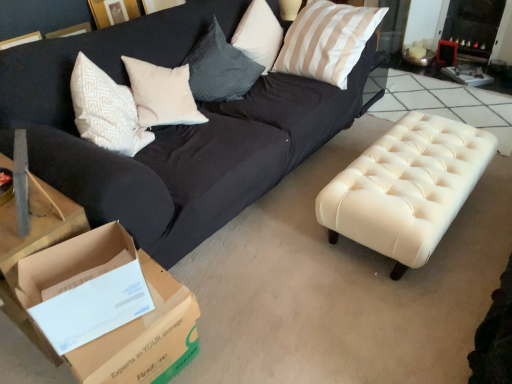
Question: Is brown cardboard box at lower left not within creamy leather ottoman at center?

Choices:
 (A) yes
 (B) no

Answer: (A)

Question: Does brown cardboard box at lower left have a greater height compared to creamy leather ottoman at center?

Choices:
 (A) yes
 (B) no

Answer: (B)

Question: From a real-world perspective, is brown cardboard box at lower left located higher than creamy leather ottoman at center?

Choices:
 (A) no
 (B) yes

Answer: (A)

Question: Is brown cardboard box at lower left closer to camera compared to creamy leather ottoman at center?

Choices:
 (A) yes
 (B) no

Answer: (A)

Question: Is brown cardboard box at lower left not close to creamy leather ottoman at center?

Choices:
 (A) yes
 (B) no

Answer: (A)

Question: Considering the relative sizes of brown cardboard box at lower left and creamy leather ottoman at center in the image provided, is brown cardboard box at lower left thinner than creamy leather ottoman at center?

Choices:
 (A) no
 (B) yes

Answer: (B)

Question: Is creamy leather ottoman at center thinner than brown cardboard box at lower left?

Choices:
 (A) no
 (B) yes

Answer: (A)

Question: Is creamy leather ottoman at center closer to the viewer compared to brown cardboard box at lower left?

Choices:
 (A) yes
 (B) no

Answer: (B)

Question: Does creamy leather ottoman at center appear on the left side of brown cardboard box at lower left?

Choices:
 (A) no
 (B) yes

Answer: (A)

Question: Can brown cardboard box at lower left be found inside creamy leather ottoman at center?

Choices:
 (A) yes
 (B) no

Answer: (B)

Question: From the image's perspective, would you say creamy leather ottoman at center is positioned over brown cardboard box at lower left?

Choices:
 (A) no
 (B) yes

Answer: (B)

Question: Can you confirm if creamy leather ottoman at center is positioned to the right of brown cardboard box at lower left?

Choices:
 (A) yes
 (B) no

Answer: (A)

Question: Is silky beige pillow at upper right at the right side of brown cardboard box at lower left?

Choices:
 (A) no
 (B) yes

Answer: (B)